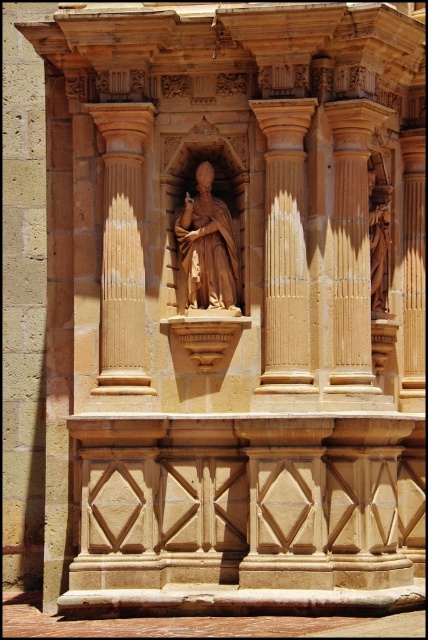
Question: Is sandy beige stone column at left thinner than smooth stone column at right?

Choices:
 (A) yes
 (B) no

Answer: (B)

Question: Among these objects, which one is farthest from the camera?

Choices:
 (A) sandy stone column at center
 (B) smooth stone column at right
 (C) sandy beige stone column at left
 (D) matte brown statue at center

Answer: (D)

Question: Which is nearer to the smooth stone column at right?

Choices:
 (A) matte brown statue at center
 (B) sandy stone column at center

Answer: (B)

Question: Is sandy stone column at center bigger than smooth stone column at right?

Choices:
 (A) yes
 (B) no

Answer: (A)

Question: Does sandy stone column at center have a smaller size compared to matte brown statue at center?

Choices:
 (A) no
 (B) yes

Answer: (B)

Question: Which object is closer to the camera taking this photo?

Choices:
 (A) sandy beige stone column at left
 (B) sandy stone column at center
 (C) matte brown statue at center
 (D) smooth stone column at right

Answer: (B)